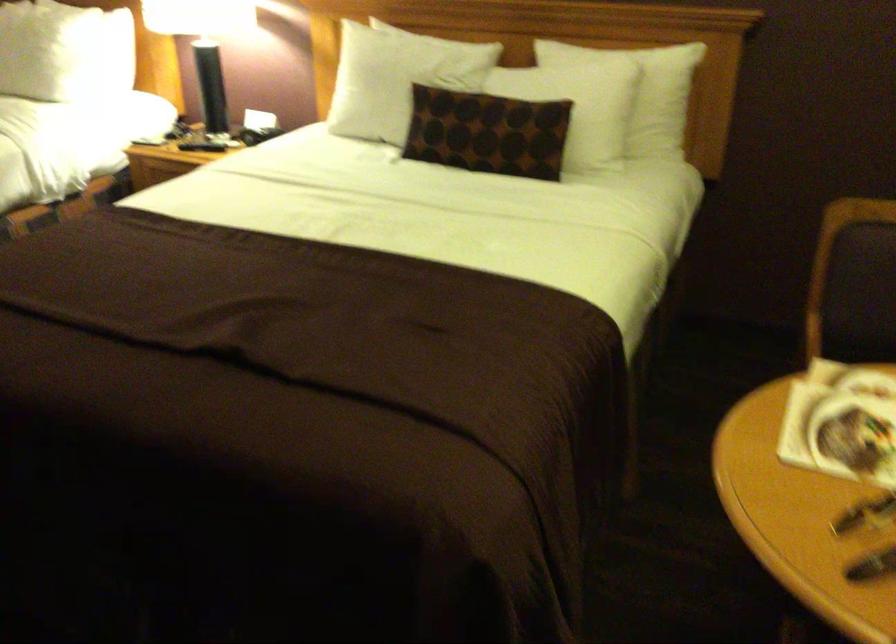
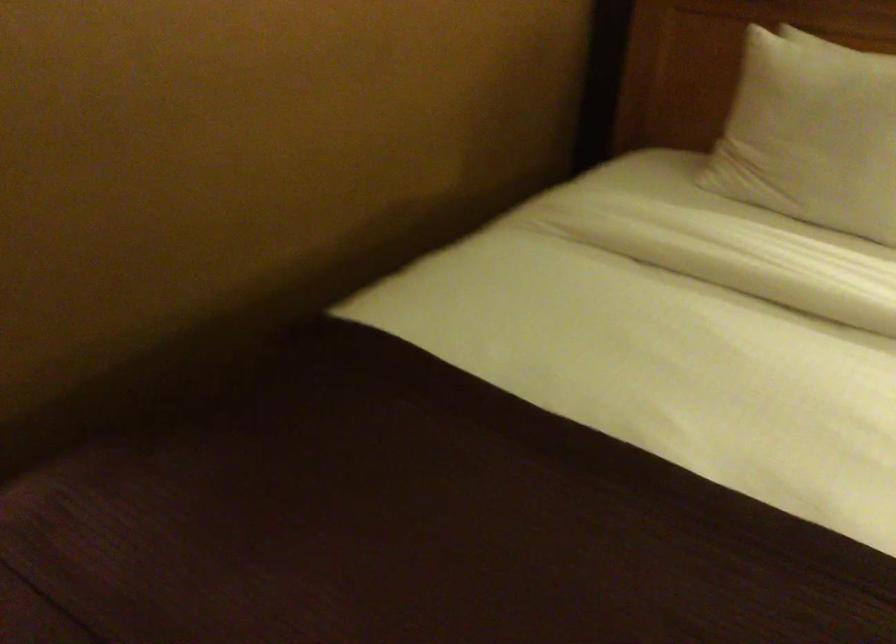
What movement of the cameraman would produce the second image?

The cameraman walked toward left, forward.